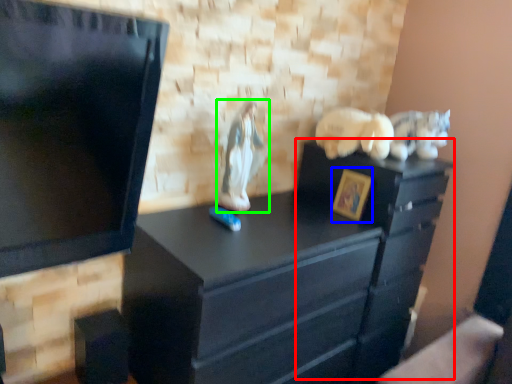
Question: Based on their relative distances, which object is nearer to file cabinet (highlighted by a red box)? Choose from picture frame (highlighted by a blue box) and animal (highlighted by a green box).

Choices:
 (A) picture frame
 (B) animal

Answer: (A)